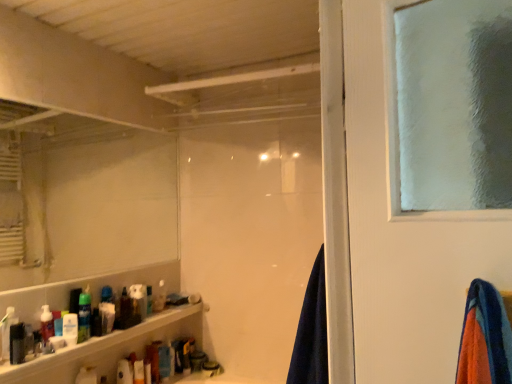
Question: Considering their positions, is translucent plastic soap dispenser at lower left, which ranks as the sixth toiletry in back-to-front order, located in front of or behind translucent plastic bottle at lower left, the eighth toiletry from the front?

Choices:
 (A) behind
 (B) front

Answer: (B)

Question: Considering the relative positions of translucent plastic soap dispenser at lower left, which ranks as the sixth toiletry in back-to-front order, and translucent plastic bottle at lower left, the 1th toiletry positioned from the back, in the image provided, is translucent plastic soap dispenser at lower left, which ranks as the sixth toiletry in back-to-front order, to the left or to the right of translucent plastic bottle at lower left, the 1th toiletry positioned from the back,?

Choices:
 (A) right
 (B) left

Answer: (B)

Question: Which object is the farthest from the white matte mirror at upper left?

Choices:
 (A) white matte lotion at lower left, acting as the 4th toiletry starting from the front
 (B) translucent plastic bottle at lower left, the 1th toiletry positioned from the back
 (C) white glossy bottle at lower left, placed as the seventh toiletry when sorted from back to front
 (D) navy blue fabric at center
 (E) translucent plastic spray can at lower left, which is counted as the 4th toiletry, starting from the back

Answer: (D)

Question: Which object is the closest to the translucent plastic spray can at lower left, placed as the fifth toiletry when sorted from front to back?

Choices:
 (A) white matte soap dispenser at center, marked as the 7th toiletry in a front-to-back arrangement
 (B) white matte mirror at upper left
 (C) translucent plastic soap dispenser at lower left, which ranks as the sixth toiletry in back-to-front order
 (D) translucent plastic bottle at lower left, the eighth toiletry from the front
 (E) white matte lotion at lower left, which is the fifth toiletry from back to front

Answer: (E)